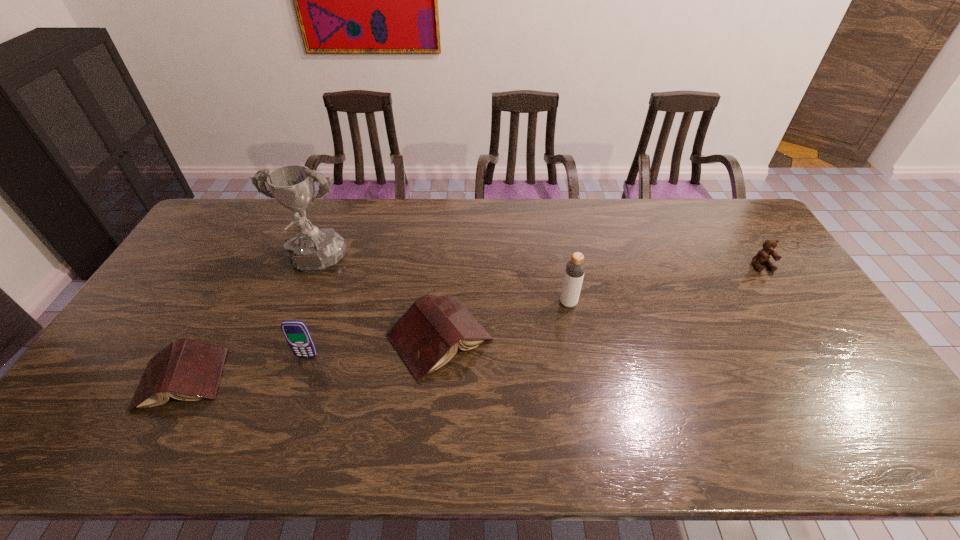
Please point a spot on the right to add another book. Please provide its 2D coordinates. Your answer should be formatted as a tuple, i.e. [(x, y)], where the tuple contains the x and y coordinates of a point satisfying the conditions above.

[(661, 302)]